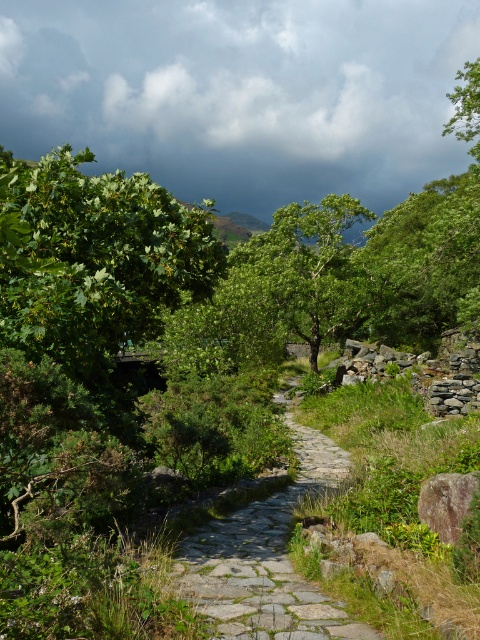
You are standing at the starting point of the stone pathway in the image. You see two points marked on the path ahead of you. One is labeled as point (4, 84) and the other as point (264, 250). Which point is closer to your current position?

Point (264, 250) is closer to your current position because it is in front of point (4, 84), which is further back along the path.

You are an artist sketching this landscape and want to place the dark gray cloud at upper center accurately. According to the coordinates, where should you position it on your paper?

The dark gray cloud at upper center should be positioned at the coordinates point (241,92) on the paper.